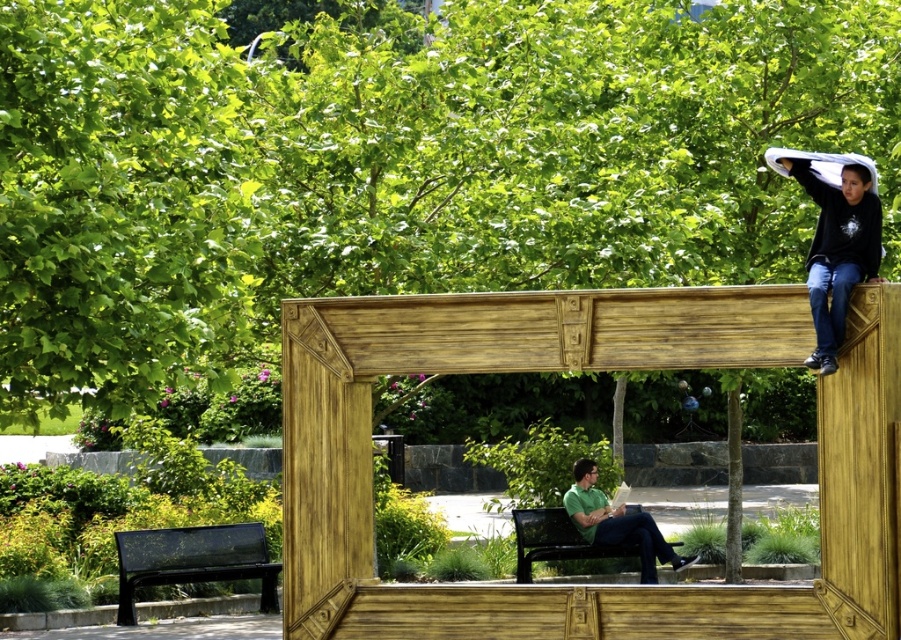
You are standing at the base of the rustic wooden archway in the park. You notice two points marked in the scene. The first point is at coordinates point (x=157, y=564) and the second is at point (x=672, y=556). From your position, which point is closer to you?

Point (x=157, y=564) is in front of point (x=672, y=556), so the first point is closer to you.

You are standing at the center of the park and want to sit on the black metal bench at lower left. Which direction should you walk to reach it?

The black metal bench at lower left is located at point (193, 561), so you should walk towards the lower left direction to reach it.

You are a landscape architect designing a new park layout. You need to place a bench between the green leafy tree at upper center and the green leafy tree at upper left. Which tree should the bench be closer to if you want it to be near the wider tree?

The bench should be placed closer to the green leafy tree at upper center because its width surpasses that of the green leafy tree at upper left.